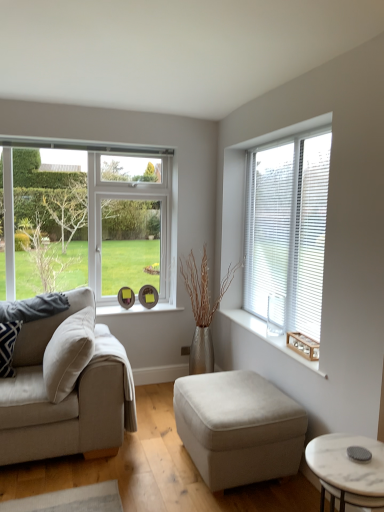
Identify the location of free space above patterned fabric pillow at left (from a real-world perspective). This screenshot has height=512, width=384. (7, 320).